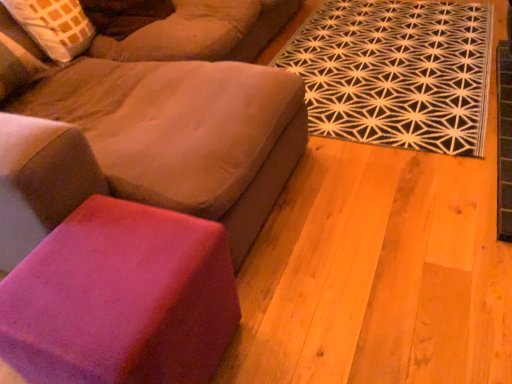
I want to click on vacant point to the right of purple suede stool at lower left, so click(292, 309).